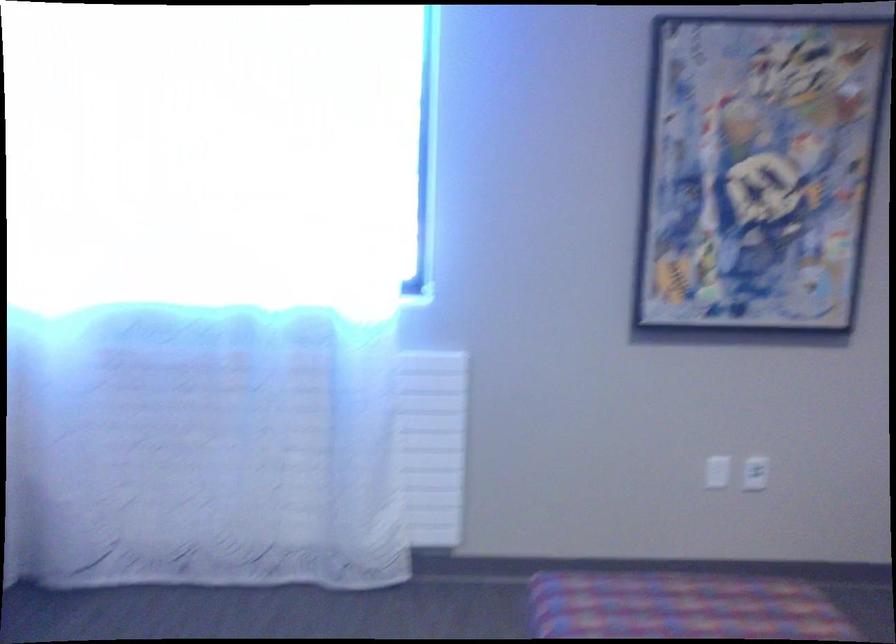
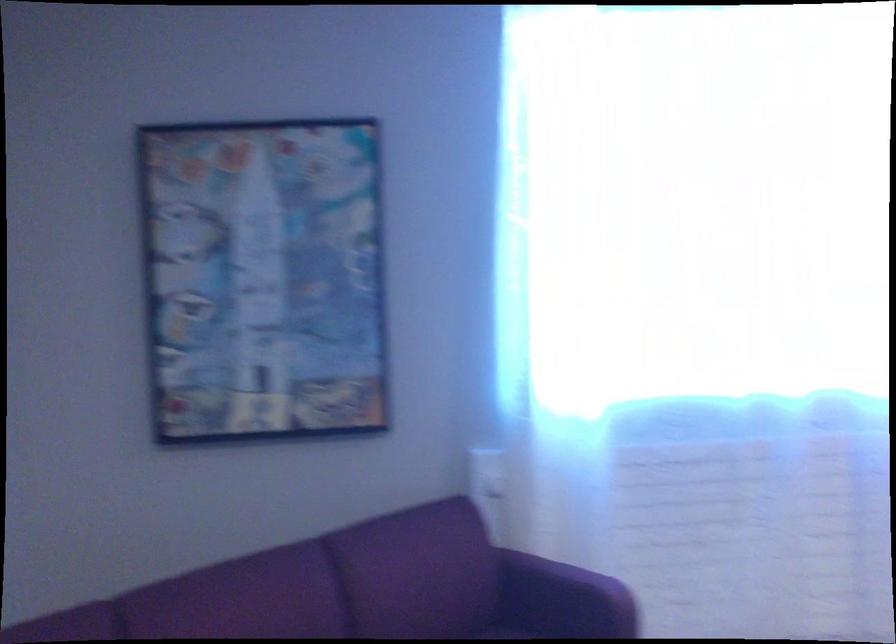
Question: What movement of the cameraman would produce the second image?

Choices:
 (A) Left
 (B) Right
 (C) Forward
 (D) Backward

Answer: (A)